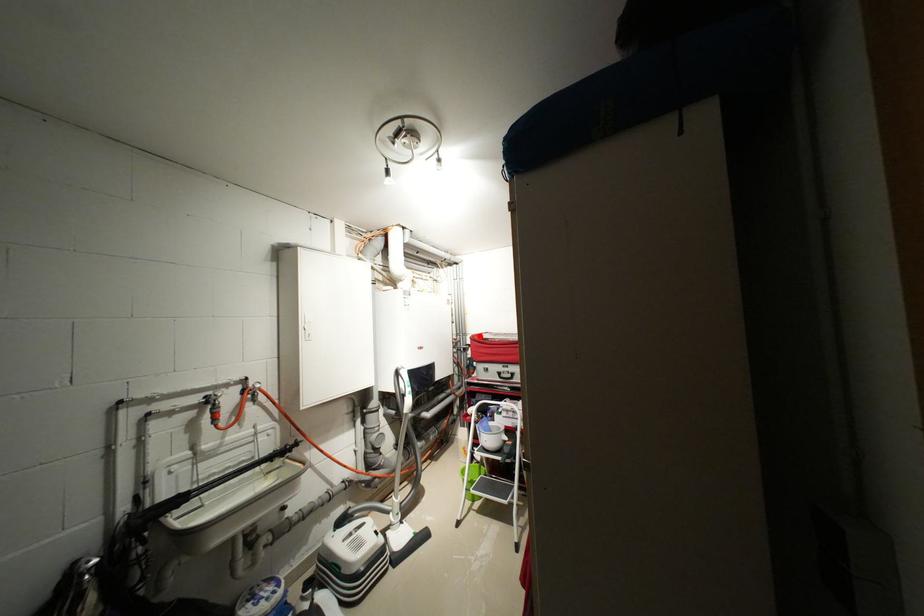
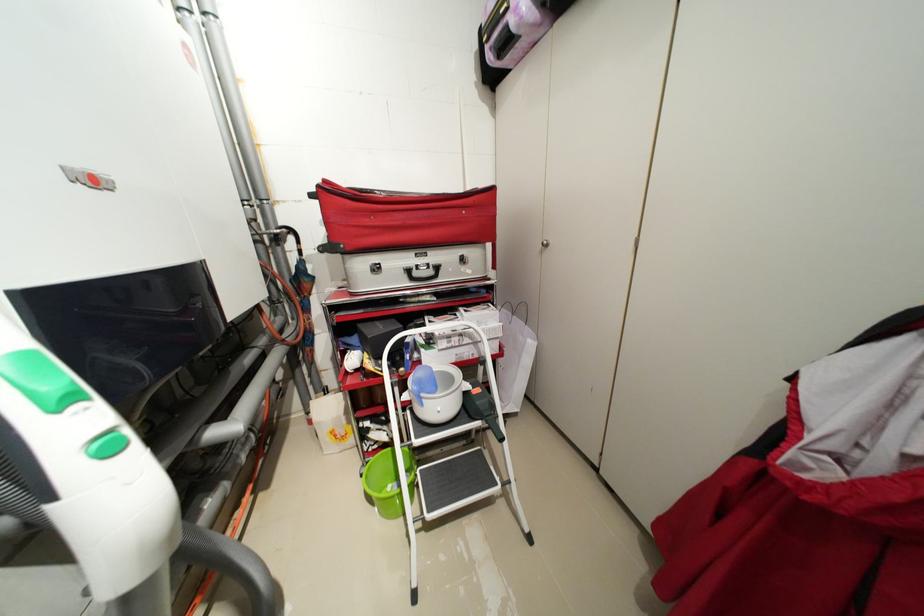
Locate, in the second image, the point that corresponds to the highlighted location in the first image.

(332, 182)